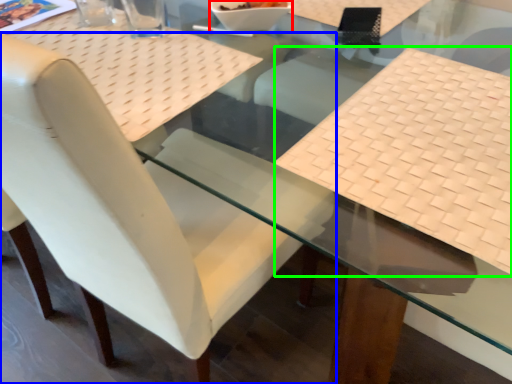
Question: Which object is positioned closest to glass bowl (highlighted by a red box)? Select from chair (highlighted by a blue box) and tablecloth (highlighted by a green box).

Choices:
 (A) chair
 (B) tablecloth

Answer: (B)